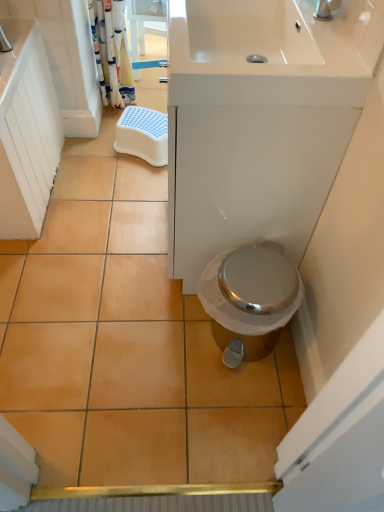
Question: From the image's perspective, would you say white fabric shower curtain at upper left is shown under white glossy sink at upper center?

Choices:
 (A) yes
 (B) no

Answer: (B)

Question: Considering the relative sizes of white fabric shower curtain at upper left and white glossy sink at upper center in the image provided, is white fabric shower curtain at upper left bigger than white glossy sink at upper center?

Choices:
 (A) no
 (B) yes

Answer: (A)

Question: Is white fabric shower curtain at upper left oriented towards white glossy sink at upper center?

Choices:
 (A) no
 (B) yes

Answer: (A)

Question: Can you confirm if white fabric shower curtain at upper left is positioned to the right of white glossy sink at upper center?

Choices:
 (A) no
 (B) yes

Answer: (A)

Question: Is white fabric shower curtain at upper left not near white glossy sink at upper center?

Choices:
 (A) yes
 (B) no

Answer: (A)

Question: Is white fabric shower curtain at upper left turned away from white glossy sink at upper center?

Choices:
 (A) yes
 (B) no

Answer: (B)

Question: Considering the relative sizes of white glossy sink at upper center and white fabric shower curtain at upper left in the image provided, is white glossy sink at upper center thinner than white fabric shower curtain at upper left?

Choices:
 (A) no
 (B) yes

Answer: (A)

Question: Can you confirm if white glossy sink at upper center is positioned to the right of white fabric shower curtain at upper left?

Choices:
 (A) yes
 (B) no

Answer: (A)

Question: Is white glossy sink at upper center not close to white fabric shower curtain at upper left?

Choices:
 (A) yes
 (B) no

Answer: (A)

Question: From a real-world perspective, is white glossy sink at upper center below white fabric shower curtain at upper left?

Choices:
 (A) yes
 (B) no

Answer: (B)

Question: Considering the relative positions of white glossy sink at upper center and white fabric shower curtain at upper left in the image provided, is white glossy sink at upper center to the left of white fabric shower curtain at upper left from the viewer's perspective?

Choices:
 (A) no
 (B) yes

Answer: (A)

Question: Is white glossy sink at upper center oriented away from white fabric shower curtain at upper left?

Choices:
 (A) no
 (B) yes

Answer: (A)

Question: Is white glossy sink at upper center far from white plastic step stool at center?

Choices:
 (A) no
 (B) yes

Answer: (A)